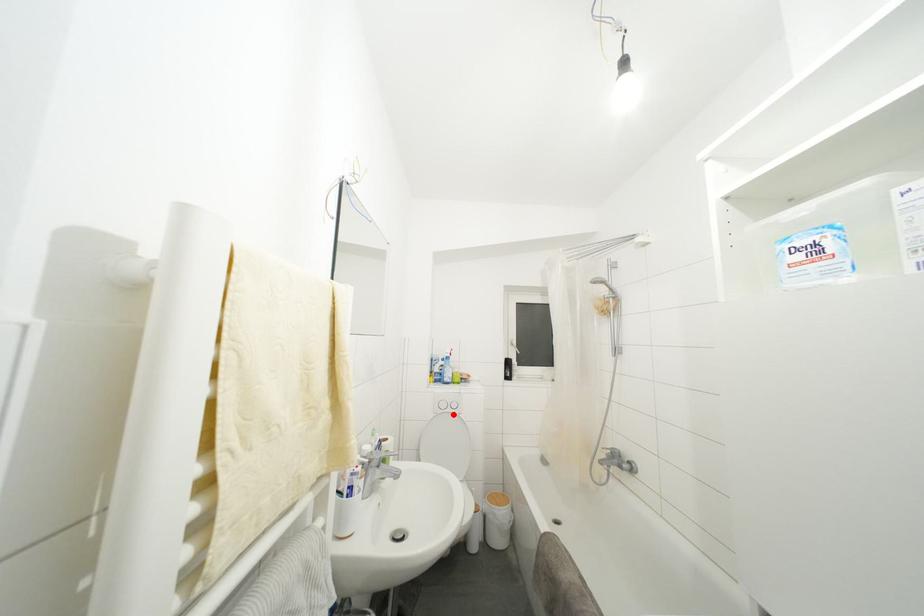
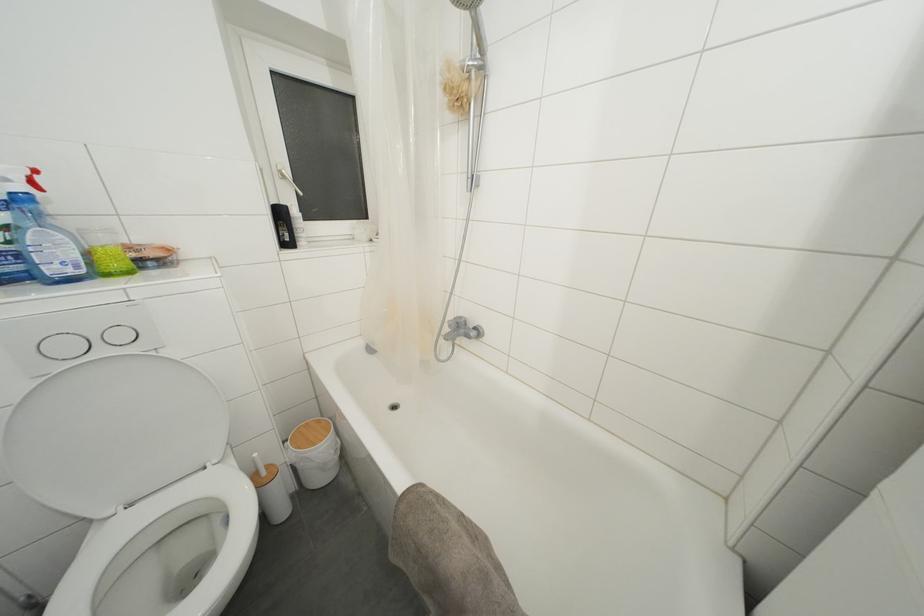
Question: I am providing you with two images of the same scene from different viewpoints. Given a red point in image1, look at the same physical point in image2. Is it:

Choices:
 (A) Closer to the viewpoint
 (B) Farther from the viewpoint

Answer: (A)